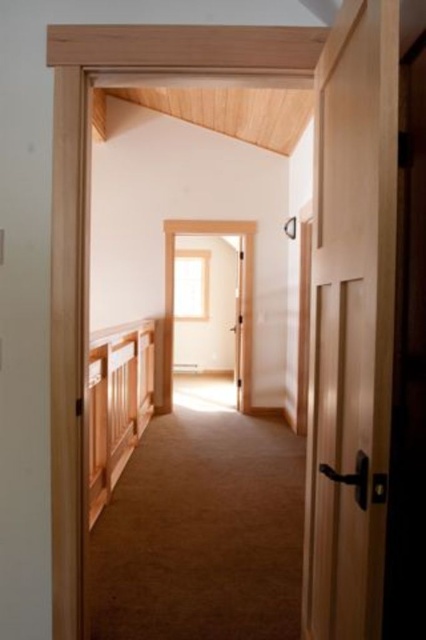
You are standing in the hallway and want to exit through the door. Which object should you approach first, the light brown wooden door at right or the wooden textured rail at left?

The light brown wooden door at right is positioned on the right side of the wooden textured rail at left. Therefore, to exit through the door, you should approach the wooden textured rail at left first before reaching the light brown wooden door at right.

You are standing in the hallway and want to move towards the window at the far end. Which point, point (x=327, y=467) or point (x=95, y=422), is closer to your current position?

Point (x=327, y=467) is closer to the camera than point (x=95, y=422), so it is closer to your current position.

You are a painter who needs to know which object is taller between the light brown wooden door at right and the wooden textured rail at left. Can you tell me which one is taller?

The light brown wooden door at right has a greater height compared to the wooden textured rail at left, so the light brown wooden door at right is taller.